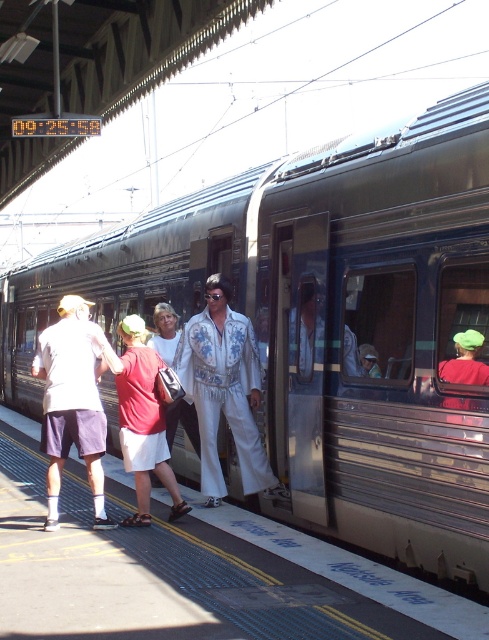
You are a photographer on the train platform and need to capture both the white satin suit at center and the red cotton shirt at center in a single frame. Which subject should you focus on first to ensure both are in the shot?

The white satin suit at center is larger in size than the red cotton shirt at center, so focusing on the white satin suit at center first will help ensure both are captured in the frame.

You are a photographer carrying a camera that is 0.5 meters wide. You are standing on the platform and want to move between the white satin suit at center and the matte white shirt at left to get a better angle. Can your camera fit through the space between them?

The space between the white satin suit at center and the matte white shirt at left is 1.27 meters. Since your camera is only 0.5 meters wide, it can easily fit through the space between them.